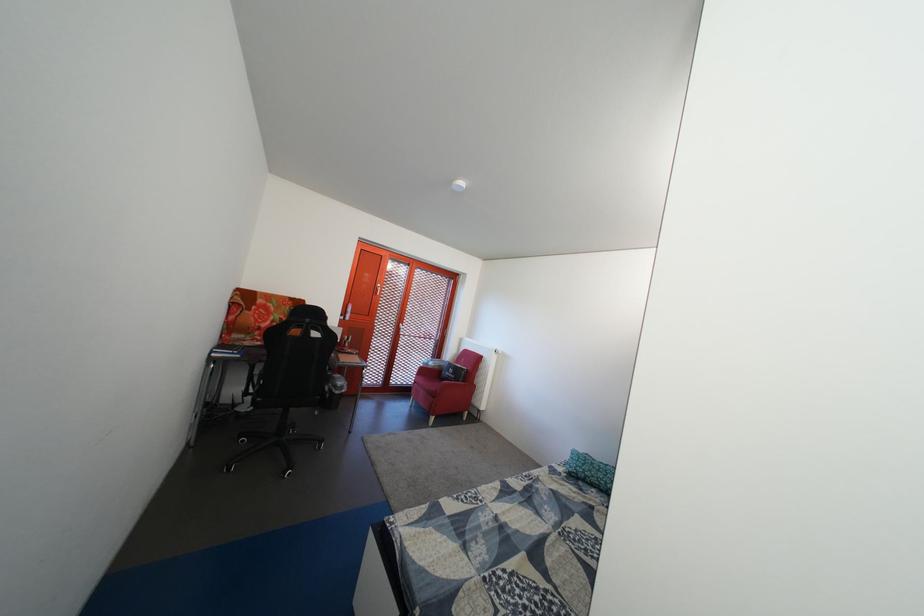
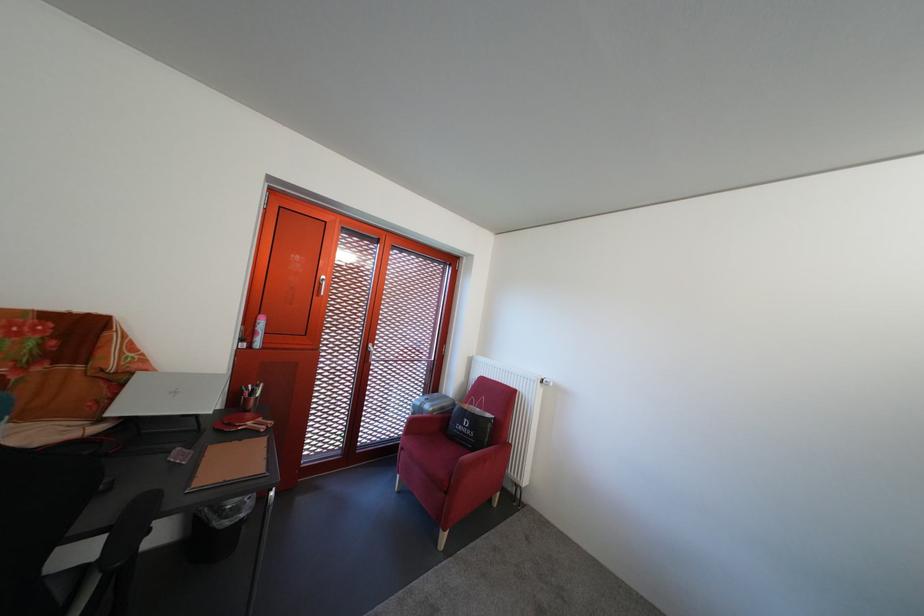
Find the pixel in the second image that matches pixel 451 373 in the first image.

(454, 415)